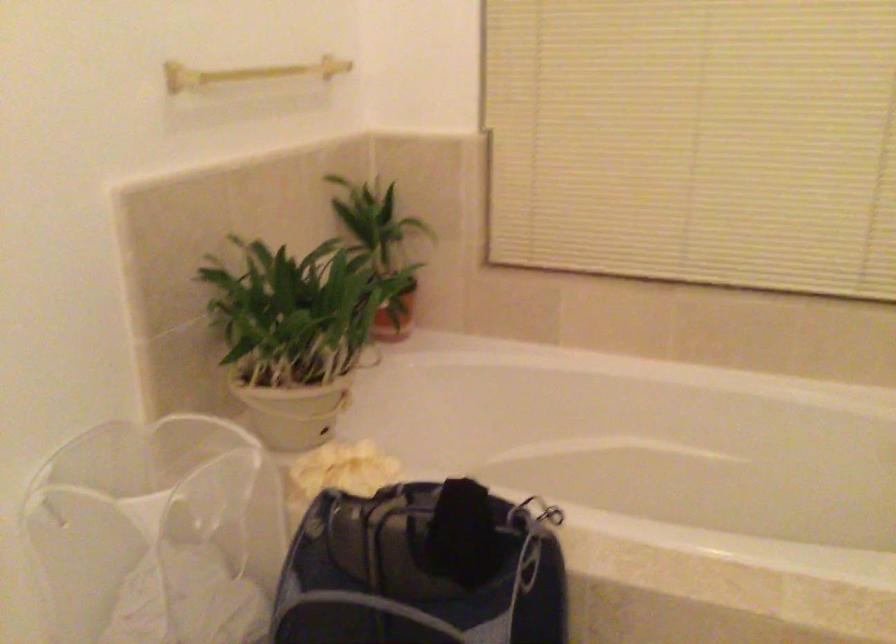
Where would you lift the white plant pot? Please return your answer as a coordinate pair (x, y).

(289, 410)